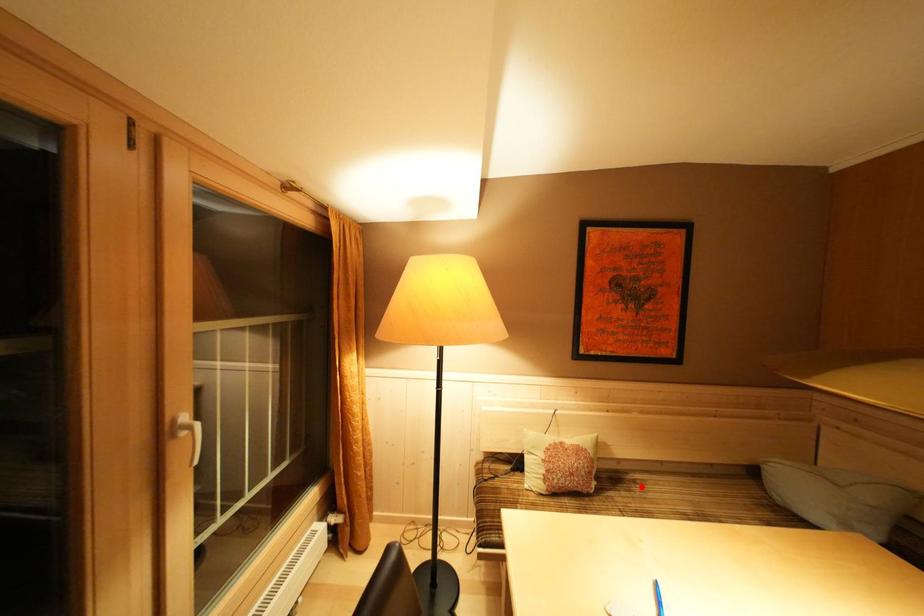
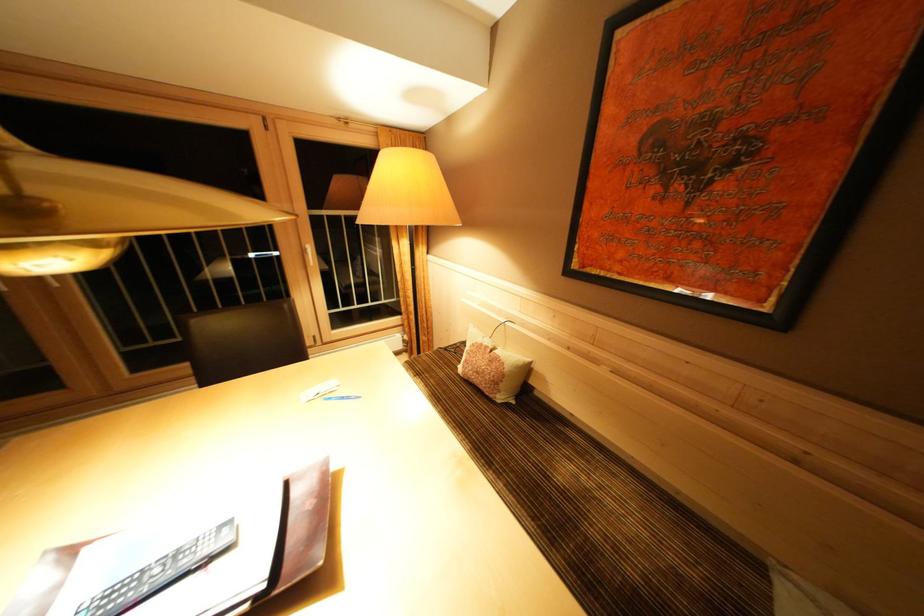
The point at the highlighted location is marked in the first image. Where is the corresponding point in the second image?

(565, 438)